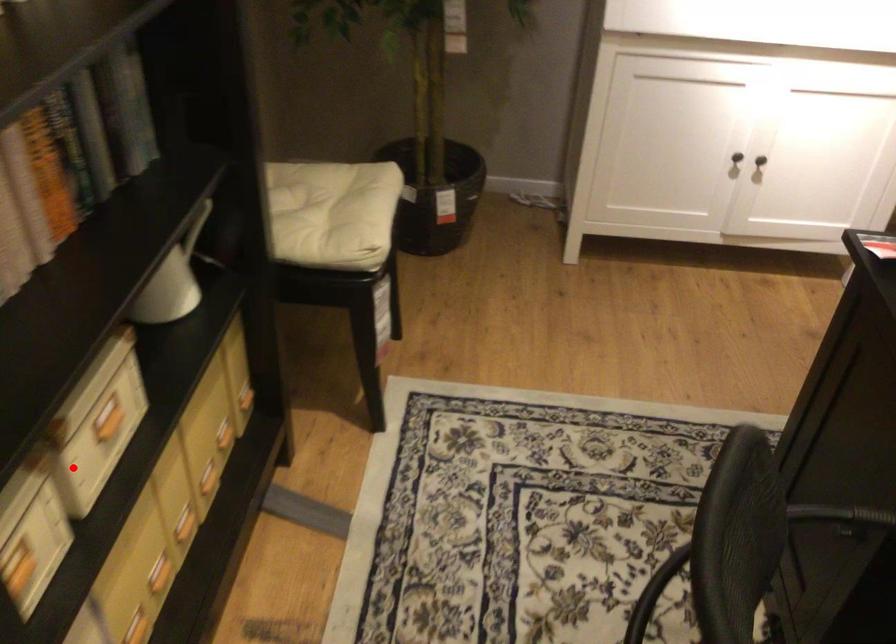
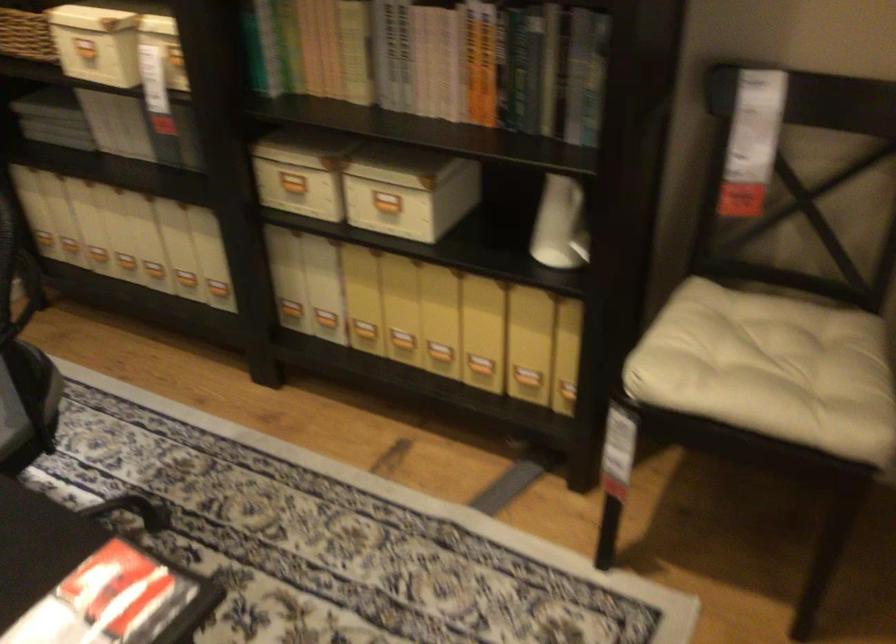
Find the pixel in the second image that matches the highlighted location in the first image.

(386, 204)